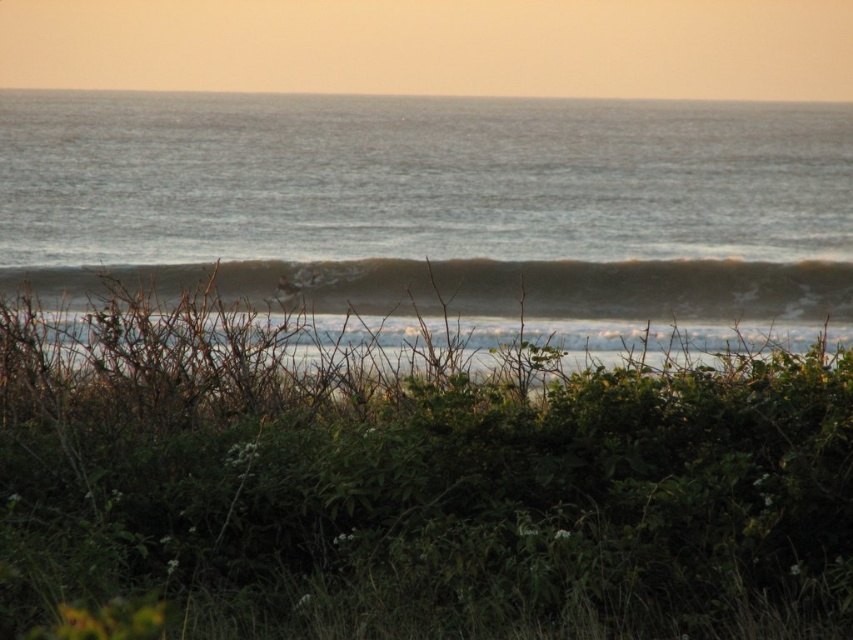
You are standing on the beach looking out at the scene. Which object is closer to you, the blue water at center or the white foam wave at center?

The white foam wave at center is closer to you because the blue water at center is positioned over it, indicating it is behind the wave.

You are standing at point A at point (128,605) and want to walk to point B. The distance between them is 19.73 feet. If you can walk 3 feet per second, how long will it take you to reach point B?

The distance between point A at point (128,605) and point B is 19.73 feet. At a walking speed of 3 feet per second, it will take approximately 6.58 seconds to reach point B.

You are standing on the beach and see the green leafy bush at center and the white foam wave at center. Which object is nearer to you?

The green leafy bush at center is closer to the viewer than the white foam wave at center.